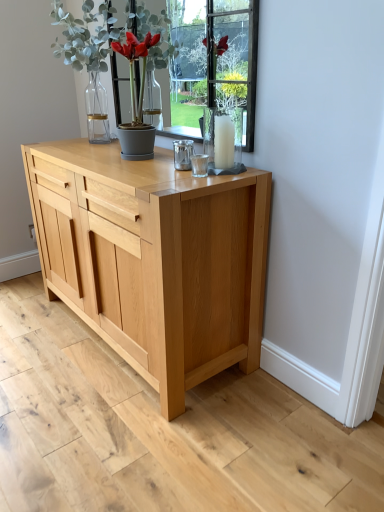
I want to click on free location in front of natural wood chest of drawers at center, so click(136, 431).